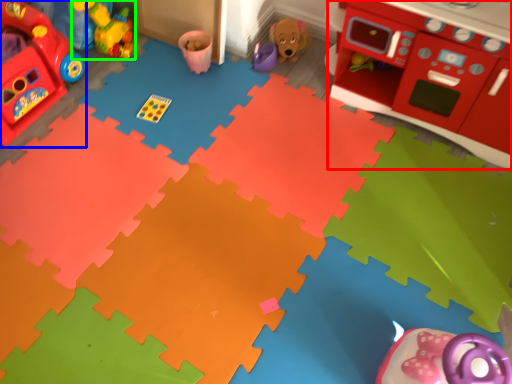
Question: Which object is the closest to the appliance (highlighted by a red box)? Choose among these: toy (highlighted by a blue box) or toy (highlighted by a green box).

Choices:
 (A) toy
 (B) toy

Answer: (B)